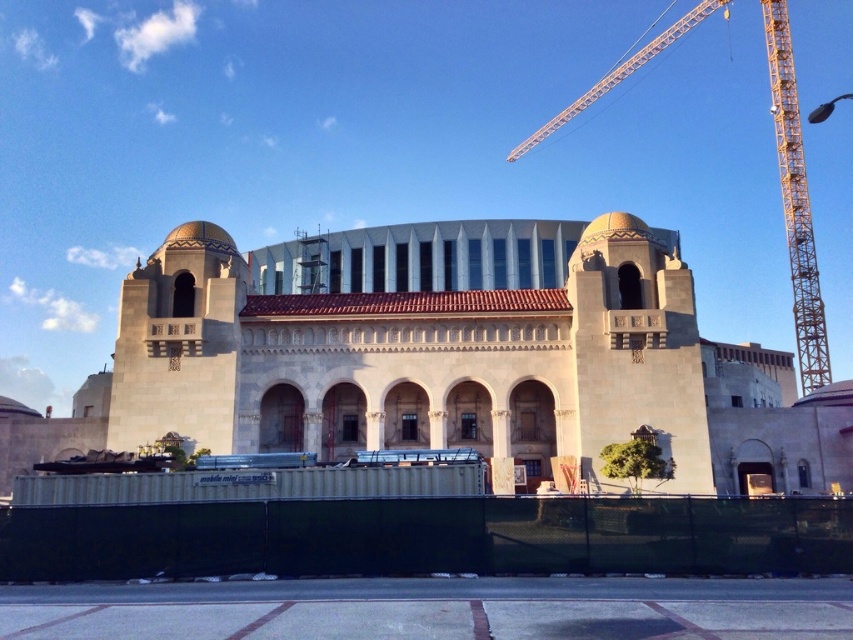
You are standing in front of the beige stone building at center. What are the coordinates of its location?

The beige stone building at center is located at coordinates point (416, 356).

You are an architect analyzing the building complex. The beige stone building at center and the yellow metal crane at upper right are part of your study. Based on their widths, which structure would require a wider foundation to support its base?

The yellow metal crane at upper right requires a wider foundation because its width is greater than the beige stone building at center, as stated in the description.

In the scene shown: You are a construction worker standing at the beige stone building at center and need to move materials to the yellow metal crane at upper right. The crane operator says they can safely handle materials up to 70 meters away. Can you safely send materials from your current position to the crane?

The distance between the beige stone building at center and the yellow metal crane at upper right is 73.66 meters, which exceeds the crane operator safety limit of 70 meters. Therefore, it is not safe to send materials from the beige stone building at center to the crane.